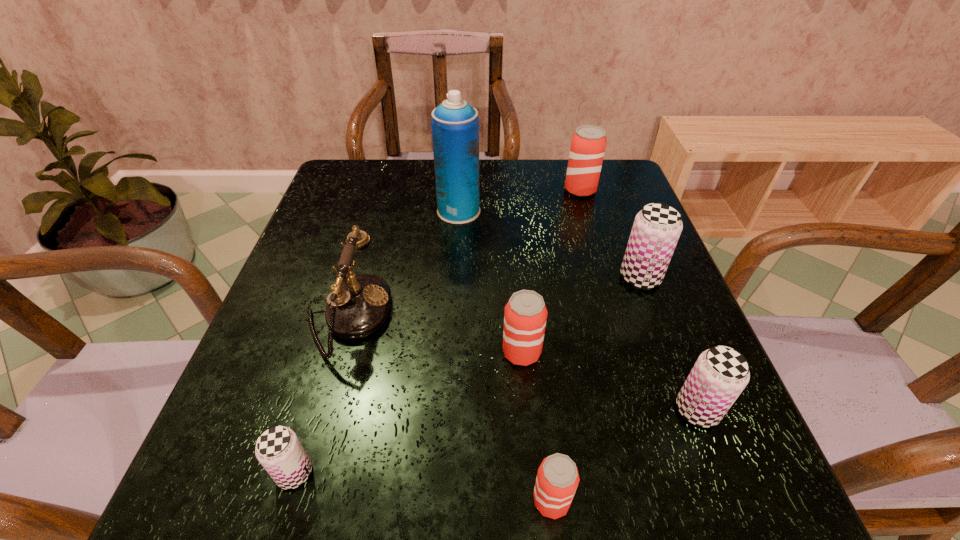
You are a GUI agent. You are given a task and a screenshot of the screen. Output one action in this format:
    pyautogui.click(x=<x>, y=<y>)
    Task: Click on the second smallest purple beer can
    This screenshot has height=540, width=960.
    Given the screenshot: What is the action you would take?
    pyautogui.click(x=720, y=374)

Image resolution: width=960 pixels, height=540 pixels. I want to click on the leftmost purple beer can, so click(278, 449).

Locate an element on the screen. Image resolution: width=960 pixels, height=540 pixels. the leftmost beer can is located at coordinates (278, 449).

Find the location of a particular element. This screenshot has width=960, height=540. the nearest orange beer can is located at coordinates (557, 479).

Identify the location of vacant region located 0.380m on the right of the third object from left to right. Image resolution: width=960 pixels, height=540 pixels. (632, 211).

Image resolution: width=960 pixels, height=540 pixels. I want to click on free space located 0.170m on the front of the rightmost orange beer can, so click(595, 240).

Locate an element on the screen. free location located on the front of the biggest purple beer can is located at coordinates (670, 356).

Where is `vacant area situated 0.100m on the dial of the black telephone`? This screenshot has width=960, height=540. vacant area situated 0.100m on the dial of the black telephone is located at coordinates (441, 316).

Identify the location of free point located on the right of the second nearest orange beer can. Image resolution: width=960 pixels, height=540 pixels. (685, 352).

Find the location of `free location located 0.360m on the back of the second farthest purple beer can`. free location located 0.360m on the back of the second farthest purple beer can is located at coordinates (636, 251).